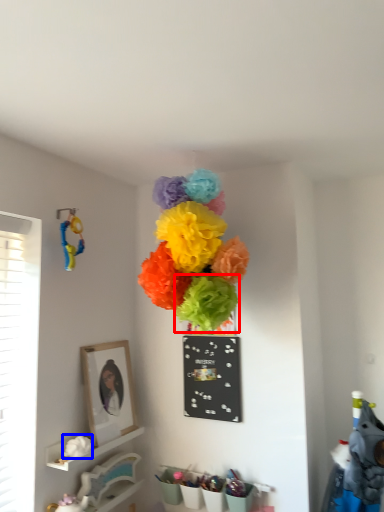
Question: Which point is further to the camera, flower (highlighted by a red box) or flower (highlighted by a blue box)?

Choices:
 (A) flower
 (B) flower

Answer: (A)